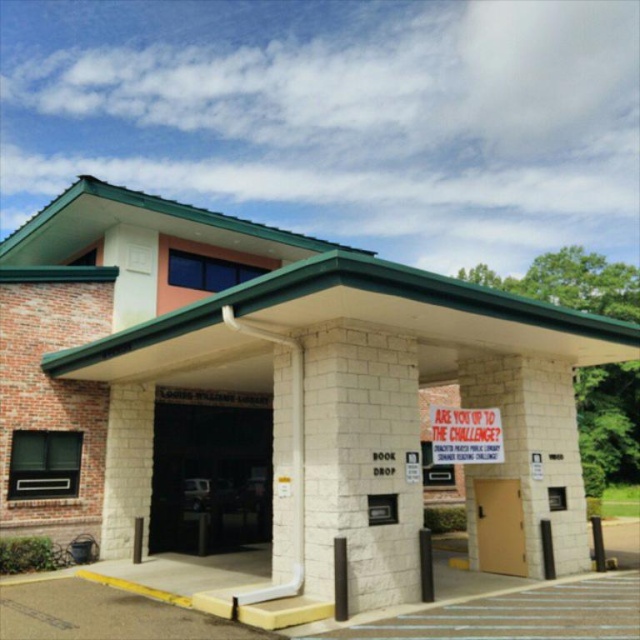
Which is more to the left, brick wall entrance at center or brown matte door at center?

Positioned to the left is brick wall entrance at center.

Can you confirm if brick wall entrance at center is positioned to the left of brown matte door at center?

Indeed, brick wall entrance at center is positioned on the left side of brown matte door at center.

Locate an element on the screen. Image resolution: width=640 pixels, height=640 pixels. brick wall entrance at center is located at coordinates (209, 472).

Between white brick building at center and brick wall entrance at center, which one is positioned higher?

white brick building at center is higher up.

Does white brick building at center lie in front of brick wall entrance at center?

That is True.

Is point (68, 252) positioned in front of point (266, 538)?

No, it is not.

The height and width of the screenshot is (640, 640). I want to click on white brick building at center, so click(x=269, y=400).

Consider the image. Can you confirm if white brick building at center is smaller than red fabric sign at center?

Actually, white brick building at center might be larger than red fabric sign at center.

Where is `white brick building at center`? white brick building at center is located at coordinates (269, 400).

Between point (209, 340) and point (449, 426), which one is positioned in front?

Point (449, 426)

Locate an element on the screen. white brick building at center is located at coordinates (269, 400).